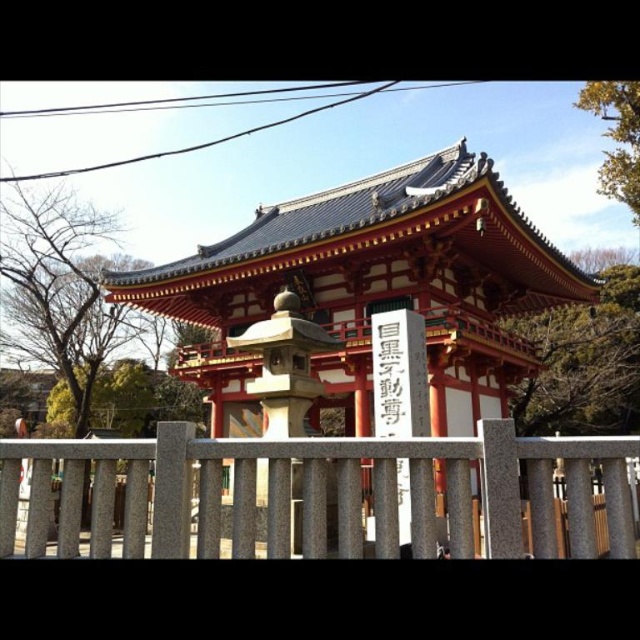
Question: Which object appears closest to the camera in this image?

Choices:
 (A) gray stone fence at center
 (B) black stone sign at center

Answer: (A)

Question: Is gray stone fence at center below black stone sign at center?

Choices:
 (A) yes
 (B) no

Answer: (A)

Question: Is gray stone fence at center above black stone sign at center?

Choices:
 (A) no
 (B) yes

Answer: (A)

Question: Among these objects, which one is farthest from the camera?

Choices:
 (A) gray stone fence at center
 (B) black stone sign at center

Answer: (B)

Question: Is gray stone fence at center positioned before black stone sign at center?

Choices:
 (A) yes
 (B) no

Answer: (A)